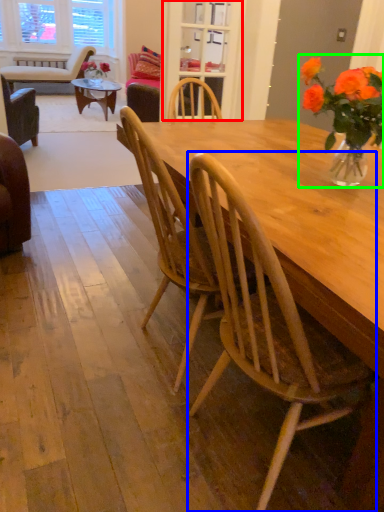
Question: Which is nearer to the glass door (highlighted by a red box)? chair (highlighted by a blue box) or floral arrangement (highlighted by a green box).

Choices:
 (A) chair
 (B) floral arrangement

Answer: (B)